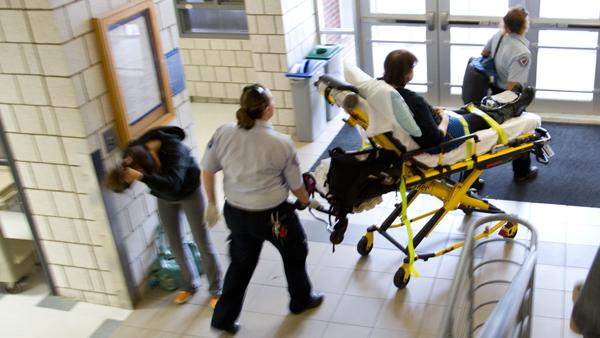
This screenshot has height=338, width=600. Identify the location of keys. (277, 232).